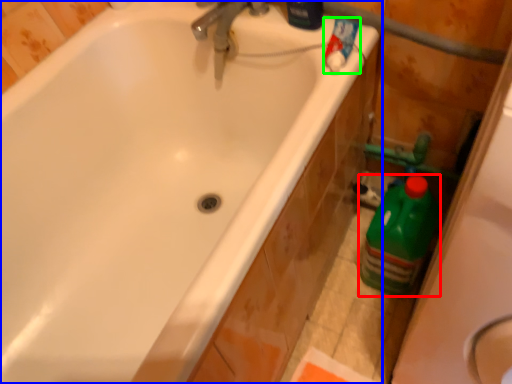
Question: Which is nearer to the cleaning product (highlighted by a red box)? bathtub (highlighted by a blue box) or cleaning product (highlighted by a green box).

Choices:
 (A) bathtub
 (B) cleaning product

Answer: (B)